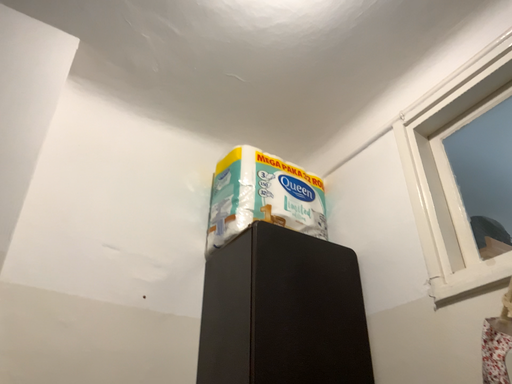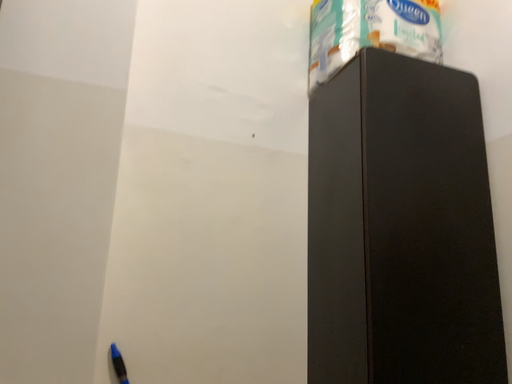
Question: Which way did the camera rotate in the video?

Choices:
 (A) rotated downward
 (B) rotated upward

Answer: (A)